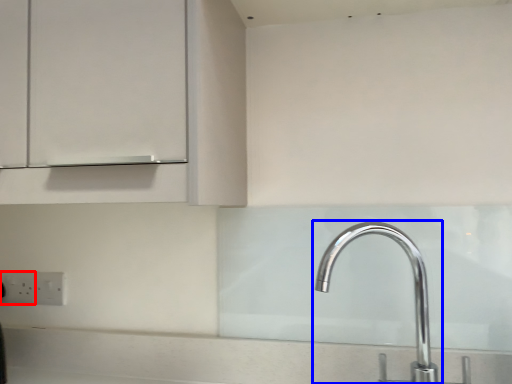
Question: Which of the following is the closest to the observer, electric outlet (highlighted by a red box) or tap (highlighted by a blue box)?

Choices:
 (A) electric outlet
 (B) tap

Answer: (B)